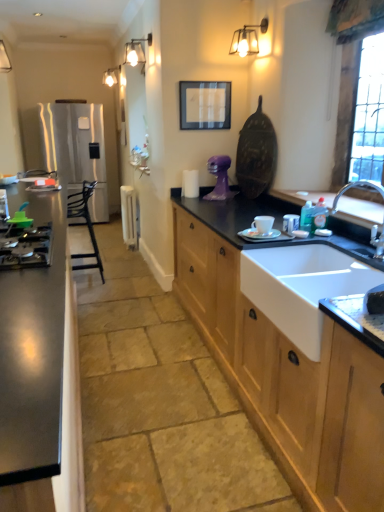
Question: Considering the positions of point (311, 323) and point (44, 450), is point (311, 323) closer or farther from the camera than point (44, 450)?

Choices:
 (A) farther
 (B) closer

Answer: (A)

Question: Is white ceramic sink at lower right to the left or to the right of stainless steel cabinet at left, arranged as the 2th cabinetry when viewed from the right, in the image?

Choices:
 (A) right
 (B) left

Answer: (A)

Question: Which is nearer to the shiny metallic gas stove at left?

Choices:
 (A) purple matte sculpture at center, placed as the second appliance when sorted from back to front
 (B) chrome metallic faucet at sink right
 (C) white plastic radiator at center, the 1th appliance in the back-to-front sequence
 (D) black matte picture frame at upper center
 (E) white ceramic sink at lower right

Answer: (E)

Question: Estimate the real-world distances between objects in this image. Which object is closer to the metallic wall sconce at upper center, positioned as the first light fixture in front-to-back order?

Choices:
 (A) black matte picture frame at upper center
 (B) shiny metallic gas stove at left
 (C) white ceramic sink at lower right
 (D) wooden cabinet at lower right, the 2th cabinetry in the left-to-right sequence
 (E) chrome metallic faucet at sink right

Answer: (A)